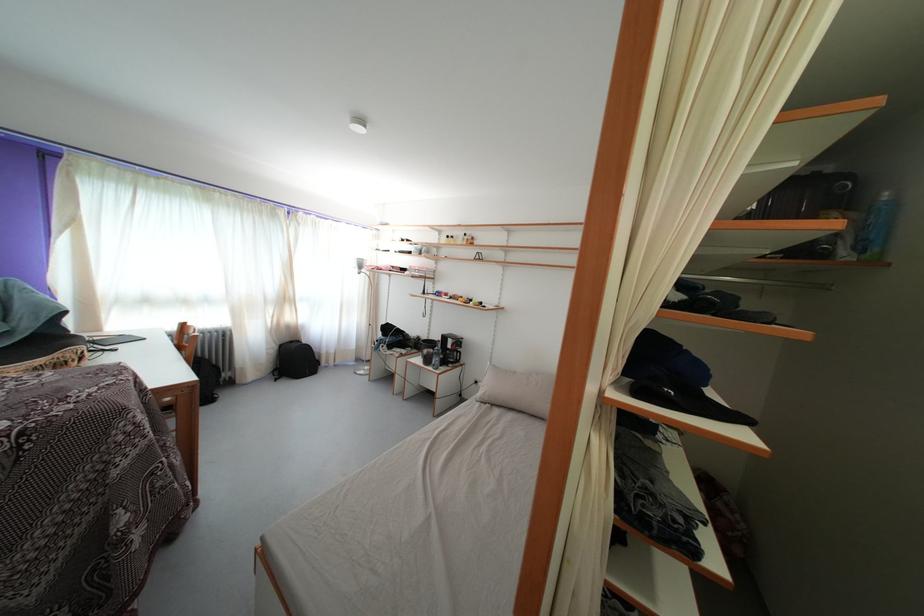
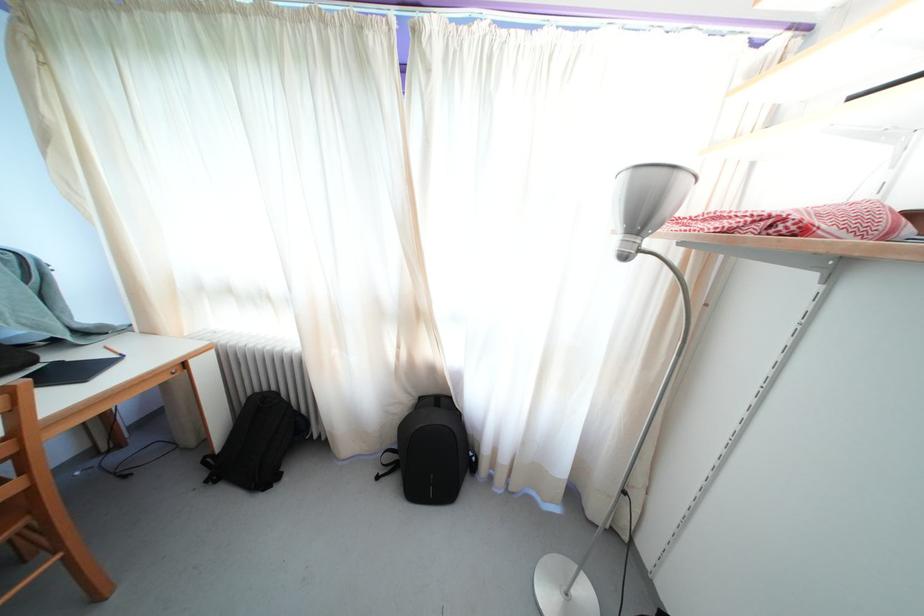
Where in the second image is the point corresponding to [286,352] from the first image?

(427, 405)